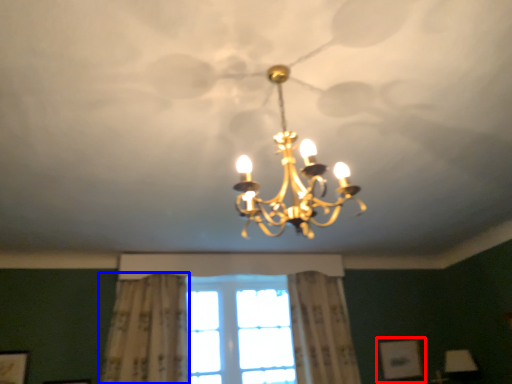
Question: Which point is closer to the camera, picture frame (highlighted by a red box) or curtain (highlighted by a blue box)?

Choices:
 (A) picture frame
 (B) curtain

Answer: (B)